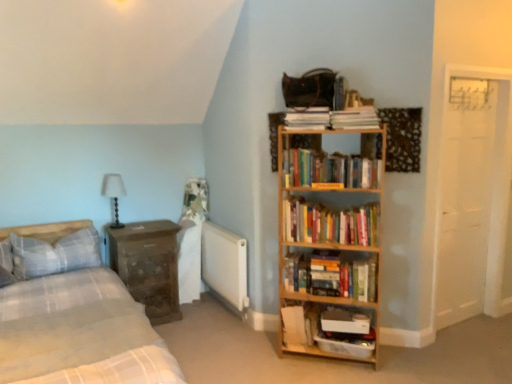
Locate an element on the screen. free location to the right of wooden bookshelf at right, the 1th shelf in the top-to-bottom sequence is located at coordinates (408, 364).